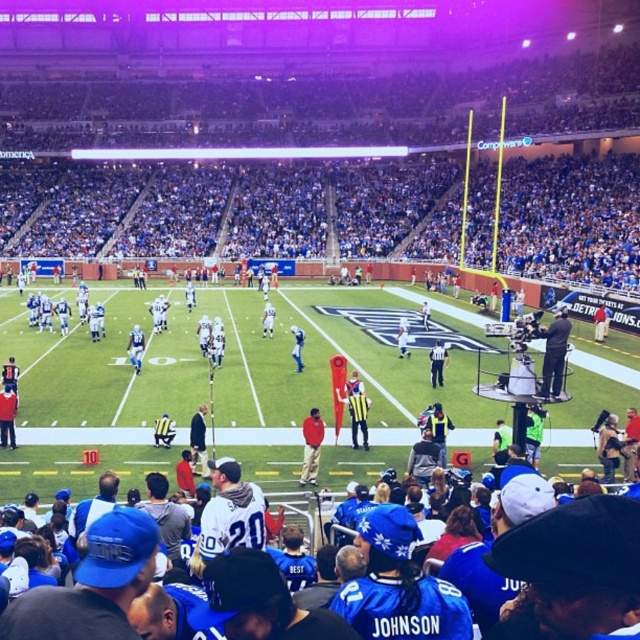
You are a photographer trying to capture a clear shot of the white uniformed official at center during the game. However, there is a black fabric camera at right blocking your view. Can you suggest a way to adjust your position to avoid the obstruction?

The black fabric camera at right is larger in size than the white uniformed official at center. To avoid the obstruction, you should move to the left side of your current position to get a clear view of the white uniformed official at center without the black fabric camera at right blocking the shot.

You are a photographer standing at the center of the field. You want to take a photo of the crowd and the black fabric camera at right. Since you can only focus on one object at a time, which object should you focus on to capture the most detailed image?

The black fabric camera at right is closer to you than the camera, so you should focus on the black fabric camera at right to capture the most detailed image.